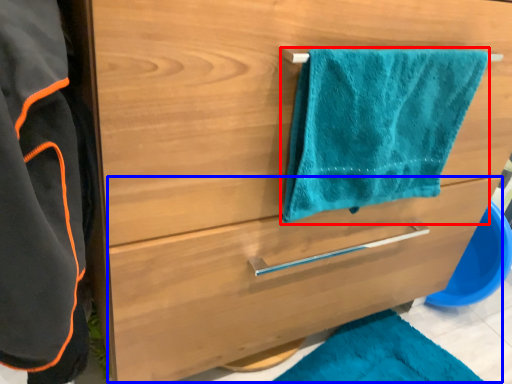
Question: Which object appears closest to the camera in this image, towel/napkin (highlighted by a red box) or drawer (highlighted by a blue box)?

Choices:
 (A) towel/napkin
 (B) drawer

Answer: (A)